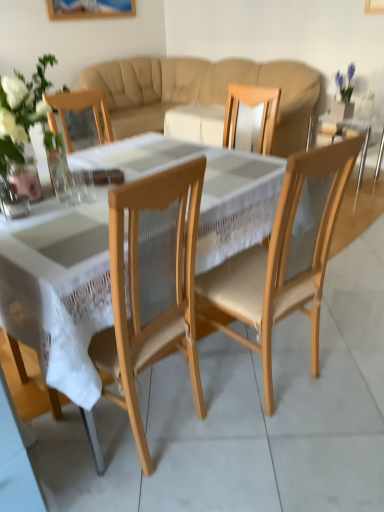
The image size is (384, 512). I want to click on empty space that is to the right of natural wood chair at center, so click(340, 367).